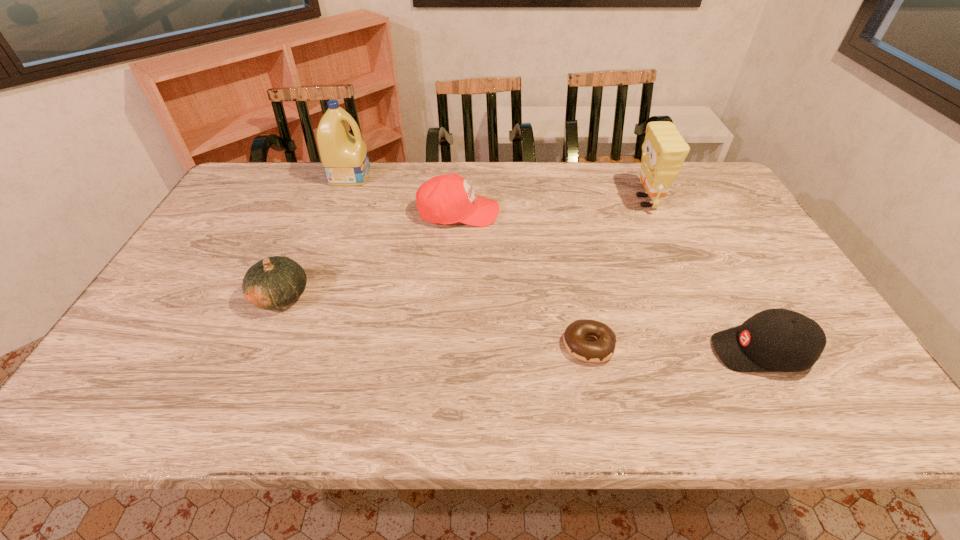
The height and width of the screenshot is (540, 960). I want to click on object identified as the fifth closest to the right baseball cap, so click(x=344, y=157).

You are a GUI agent. You are given a task and a screenshot of the screen. Output one action in this format:
    pyautogui.click(x=<x>, y=<y>)
    Task: Click on the free space that satisfies the following two spatial constraints: 1. on the front panel of the doughnut; 2. on the left side of the left baseball cap
    The image size is (960, 540).
    Given the screenshot: What is the action you would take?
    pyautogui.click(x=451, y=345)

The height and width of the screenshot is (540, 960). I want to click on free space that satisfies the following two spatial constraints: 1. on the front panel of the farther baseball cap; 2. on the right side of the doughnut, so click(x=451, y=345).

Locate an element on the screen. This screenshot has width=960, height=540. vacant region that satisfies the following two spatial constraints: 1. on the front panel of the fourth object from left to right; 2. on the right side of the third object from left to right is located at coordinates (451, 345).